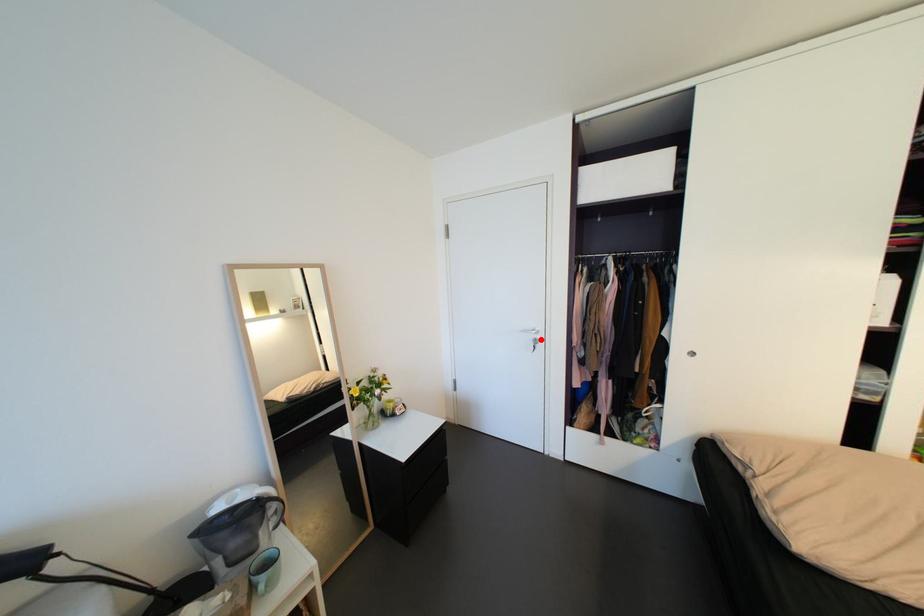
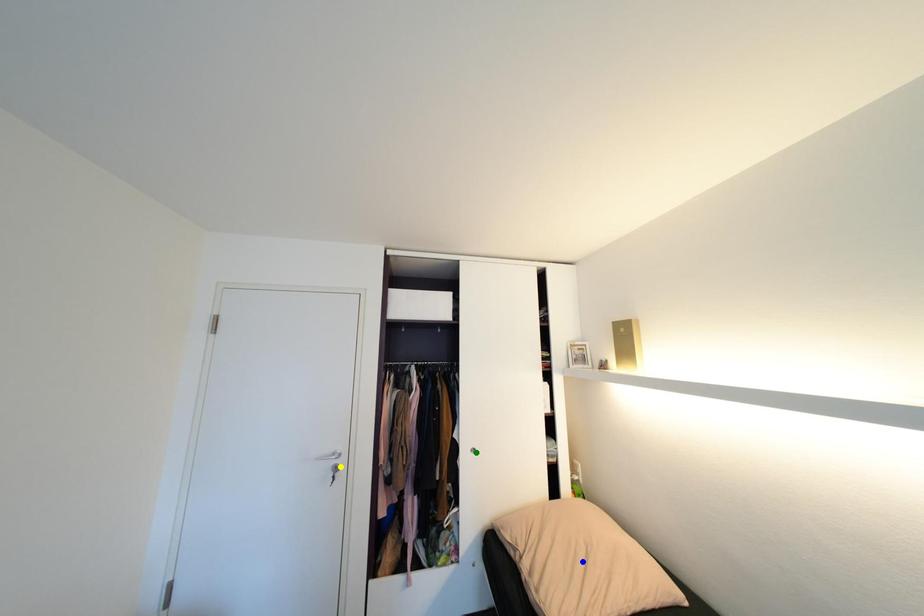
Question: I am providing you with two images of the same scene from different viewpoints. A red point is marked on the first image. You are given multiple points on the second image. In image 2, which mark is for the same physical point as the one in image 1?

Choices:
 (A) blue point
 (B) yellow point
 (C) green point

Answer: (B)